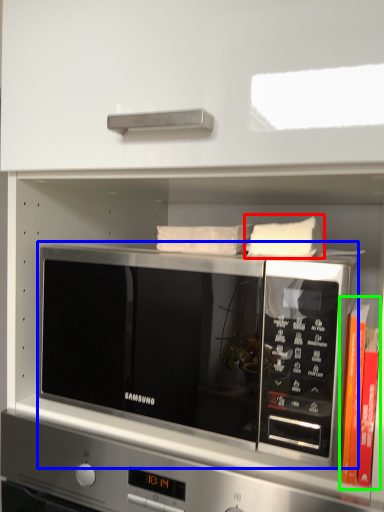
Question: Which object is the closest to the pillow (highlighted by a red box)? Choose among these: microwave oven (highlighted by a blue box) or book (highlighted by a green box).

Choices:
 (A) microwave oven
 (B) book

Answer: (B)